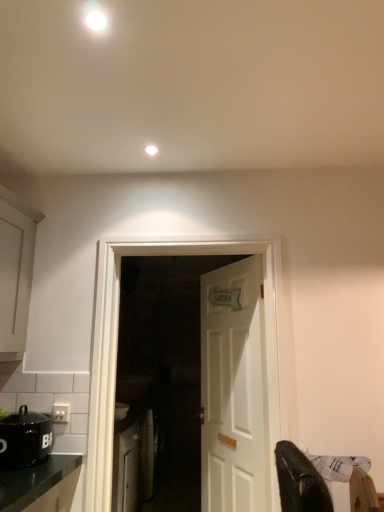
The height and width of the screenshot is (512, 384). Find the location of `black matte pot at lower left`. black matte pot at lower left is located at coordinates (25, 438).

What do you see at coordinates (151, 150) in the screenshot? I see `white matte light fixture at upper center, acting as the 2th lighting starting from the left` at bounding box center [151, 150].

At what (x,y) coordinates should I click in order to perform the action: click on white plastic electric outlet at lower left. Please return your answer as a coordinate pair (x, y). Image resolution: width=384 pixels, height=512 pixels. Looking at the image, I should click on (61, 413).

This screenshot has width=384, height=512. I want to click on white glossy cabinet at lower left, the 1th cabinetry when ordered from right to left, so click(133, 460).

From a real-world perspective, which is physically below, white matte light fixture at upper center, placed as the first lighting when sorted from bottom to top, or white plastic electric outlet at lower left?

white plastic electric outlet at lower left is physically lower.

Is white matte light fixture at upper center, acting as the 2th lighting starting from the left, with white plastic electric outlet at lower left?

white matte light fixture at upper center, acting as the 2th lighting starting from the left, is not next to white plastic electric outlet at lower left, and they're not touching.

Does white matte light fixture at upper center, which is the first lighting from back to front, have a lesser height compared to white plastic electric outlet at lower left?

Correct, white matte light fixture at upper center, which is the first lighting from back to front, is not as tall as white plastic electric outlet at lower left.

Which of these two, white matte light fixture at upper center, the 1th lighting viewed from the right, or white wooden door at center, the 1th door viewed from the front, is smaller?

white matte light fixture at upper center, the 1th lighting viewed from the right.

Is white matte light fixture at upper center, which is the first lighting from back to front, looking in the opposite direction of white wooden door at center, the 1th door viewed from the front?

No.

Who is taller, white matte light fixture at upper center, the 1th lighting viewed from the right, or white wooden door at center, the 1th door viewed from the front?

white wooden door at center, the 1th door viewed from the front.

This screenshot has width=384, height=512. Identify the location of the 1st lighting counting from the left of the white wooden door at center, arranged as the second door when viewed from the back. (151, 150).

Which of these two, white wooden door at center, the 1th door viewed from the front, or white matte light fixture at upper center, which is the first lighting from back to front, is thinner?

white matte light fixture at upper center, which is the first lighting from back to front, is thinner.

Which is correct: white wooden door at center, arranged as the second door when viewed from the back, is inside white matte light fixture at upper center, acting as the 2th lighting starting from the left, or outside of it?

white wooden door at center, arranged as the second door when viewed from the back, is not enclosed by white matte light fixture at upper center, acting as the 2th lighting starting from the left.

From a real-world perspective, count 2nd lightings upward from the white wooden door at center, the 1th door viewed from the front, and point to it. Please provide its 2D coordinates.

[(151, 150)]

Which object is more forward, white wooden door at center, arranged as the 1th door when viewed from the back, or white wooden door at center, arranged as the second door when viewed from the back?

white wooden door at center, arranged as the second door when viewed from the back.

Between white wooden door at center, marked as the 2th door in a front-to-back arrangement, and white wooden door at center, arranged as the second door when viewed from the back, which one has smaller size?

white wooden door at center, marked as the 2th door in a front-to-back arrangement, is smaller.

What's the angular difference between white wooden door at center, arranged as the 1th door when viewed from the back, and white wooden door at center, arranged as the second door when viewed from the back,'s facing directions?

There is a 64.6-degree angle between the facing directions of white wooden door at center, arranged as the 1th door when viewed from the back, and white wooden door at center, arranged as the second door when viewed from the back.

Is white wooden door at center, marked as the 2th door in a front-to-back arrangement, looking in the opposite direction of white wooden door at center, arranged as the second door when viewed from the back?

No, white wooden door at center, arranged as the second door when viewed from the back, is not at the back of white wooden door at center, marked as the 2th door in a front-to-back arrangement.

From the image's perspective, which is below, white glossy cabinet at lower left, the 1th cabinetry when ordered from back to front, or white plastic electric outlet at lower left?

white glossy cabinet at lower left, the 1th cabinetry when ordered from back to front, from the image's perspective.

Is white glossy cabinet at lower left, the 2th cabinetry positioned from the top, directly adjacent to white plastic electric outlet at lower left?

white glossy cabinet at lower left, the 2th cabinetry positioned from the top, and white plastic electric outlet at lower left are clearly separated.

Can you tell me how much white glossy cabinet at lower left, which is the 2th cabinetry in front-to-back order, and white plastic electric outlet at lower left differ in facing direction?

The angle between the facing direction of white glossy cabinet at lower left, which is the 2th cabinetry in front-to-back order, and the facing direction of white plastic electric outlet at lower left is 93.4 degrees.

Considering the relative sizes of white glossy cabinet at lower left, the 2th cabinetry positioned from the top, and white plastic electric outlet at lower left in the image provided, is white glossy cabinet at lower left, the 2th cabinetry positioned from the top, shorter than white plastic electric outlet at lower left?

No.

I want to click on door in front of the white wooden door at center, marked as the 2th door in a front-to-back arrangement, so pyautogui.click(x=117, y=348).

Is white wooden door at center, arranged as the second door when viewed from the back, turned away from white wooden door at center, arranged as the 1th door when viewed from the back?

Yes, white wooden door at center, arranged as the 1th door when viewed from the back, is at the back of white wooden door at center, arranged as the second door when viewed from the back.

Is point (249, 249) closer or farther from the camera than point (262, 346)?

Point (249, 249) is positioned closer to the camera compared to point (262, 346).

What's the angular difference between white wooden door at center, arranged as the second door when viewed from the back, and white wooden door at center, marked as the 2th door in a front-to-back arrangement,'s facing directions?

The facing directions of white wooden door at center, arranged as the second door when viewed from the back, and white wooden door at center, marked as the 2th door in a front-to-back arrangement, are 64.6 degrees apart.

Considering the sizes of white wooden door at center, the 1th door viewed from the front, and white glossy light fixture at upper center, marked as the 1th lighting in a left-to-right arrangement, in the image, is white wooden door at center, the 1th door viewed from the front, wider or thinner than white glossy light fixture at upper center, marked as the 1th lighting in a left-to-right arrangement,?

In the image, white wooden door at center, the 1th door viewed from the front, appears to be wider than white glossy light fixture at upper center, marked as the 1th lighting in a left-to-right arrangement.

From the image's perspective, between white wooden door at center, the 1th door viewed from the front, and white glossy light fixture at upper center, acting as the second lighting starting from the right, which one is located above?

white glossy light fixture at upper center, acting as the second lighting starting from the right, is shown above in the image.

Is white wooden door at center, the 1th door viewed from the front, closer to camera compared to white glossy light fixture at upper center, which is the 2th lighting in bottom-to-top order?

That is False.

Which object is positioned more to the right, white wooden door at center, the 1th door viewed from the front, or white glossy light fixture at upper center, acting as the second lighting starting from the back?

Positioned to the right is white wooden door at center, the 1th door viewed from the front.

What are the coordinates of `lighting that is the 1st object located in front of the white plastic electric outlet at lower left` in the screenshot? It's located at (151, 150).

From the image's perspective, count 1st doors downward from the white matte light fixture at upper center, marked as the second lighting in a top-to-bottom arrangement, and point to it. Please provide its 2D coordinates.

[(117, 348)]

Looking at the image, which one is located further to white plastic electric outlet at lower left, white glossy light fixture at upper center, acting as the second lighting starting from the back, or white glossy cabinet at lower left, the 1th cabinetry when ordered from right to left?

white glossy light fixture at upper center, acting as the second lighting starting from the back, is further to white plastic electric outlet at lower left.

When comparing their distances from white matte cabinet at left, which is the 1th cabinetry from top to bottom, does white wooden door at center, arranged as the 1th door when viewed from the back, or white glossy cabinet at lower left, the 2th cabinetry positioned from the top, seem closer?

white wooden door at center, arranged as the 1th door when viewed from the back, is closer to white matte cabinet at left, which is the 1th cabinetry from top to bottom.

Based on their spatial positions, is white wooden door at center, marked as the 2th door in a front-to-back arrangement, or white matte cabinet at left, the 2th cabinetry from the back, further from white glossy light fixture at upper center, acting as the second lighting starting from the right?

white wooden door at center, marked as the 2th door in a front-to-back arrangement, is further to white glossy light fixture at upper center, acting as the second lighting starting from the right.

Based on their spatial positions, is white matte cabinet at left, the 2th cabinetry from the back, or white wooden door at center, arranged as the second door when viewed from the back, closer to white glossy light fixture at upper center, arranged as the first lighting when viewed from the front?

Based on the image, white matte cabinet at left, the 2th cabinetry from the back, appears to be nearer to white glossy light fixture at upper center, arranged as the first lighting when viewed from the front.

Looking at the image, which one is located closer to black matte pot at lower left, white glossy light fixture at upper center, acting as the second lighting starting from the right, or white glossy cabinet at lower left, the 2th cabinetry positioned from the top?

Among the two, white glossy cabinet at lower left, the 2th cabinetry positioned from the top, is located nearer to black matte pot at lower left.

Looking at this image, based on their spatial positions, is white wooden door at center, marked as the 2th door in a front-to-back arrangement, or white glossy cabinet at lower left, the 1th cabinetry when ordered from right to left, further from black matte pot at lower left?

white glossy cabinet at lower left, the 1th cabinetry when ordered from right to left, is further to black matte pot at lower left.

From the image, which object appears to be nearer to white wooden door at center, arranged as the 1th door when viewed from the back, black matte pot at lower left or white glossy light fixture at upper center, arranged as the first lighting when viewed from the front?

black matte pot at lower left.

Looking at the image, which one is located further to black matte pot at lower left, white glossy light fixture at upper center, arranged as the first lighting when viewed from the front, or white matte cabinet at left, marked as the 2th cabinetry in a bottom-to-top arrangement?

The object further to black matte pot at lower left is white glossy light fixture at upper center, arranged as the first lighting when viewed from the front.

This screenshot has width=384, height=512. Find the location of `kitchen appliance located between white matte cabinet at left, the 2th cabinetry from the back, and white wooden door at center, arranged as the second door when viewed from the back, in the left-right direction`. kitchen appliance located between white matte cabinet at left, the 2th cabinetry from the back, and white wooden door at center, arranged as the second door when viewed from the back, in the left-right direction is located at coordinates (25, 438).

Image resolution: width=384 pixels, height=512 pixels. Identify the location of cabinetry between white glossy light fixture at upper center, marked as the 1th lighting in a left-to-right arrangement, and black matte pot at lower left vertically. (15, 272).

Image resolution: width=384 pixels, height=512 pixels. What are the coordinates of `door between white matte light fixture at upper center, which ranks as the 2th lighting in front-to-back order, and black matte pot at lower left vertically` in the screenshot? It's located at (117, 348).

This screenshot has height=512, width=384. What are the coordinates of `lighting that lies between white glossy light fixture at upper center, acting as the second lighting starting from the back, and white wooden door at center, arranged as the 1th door when viewed from the back, from top to bottom` in the screenshot? It's located at (151, 150).